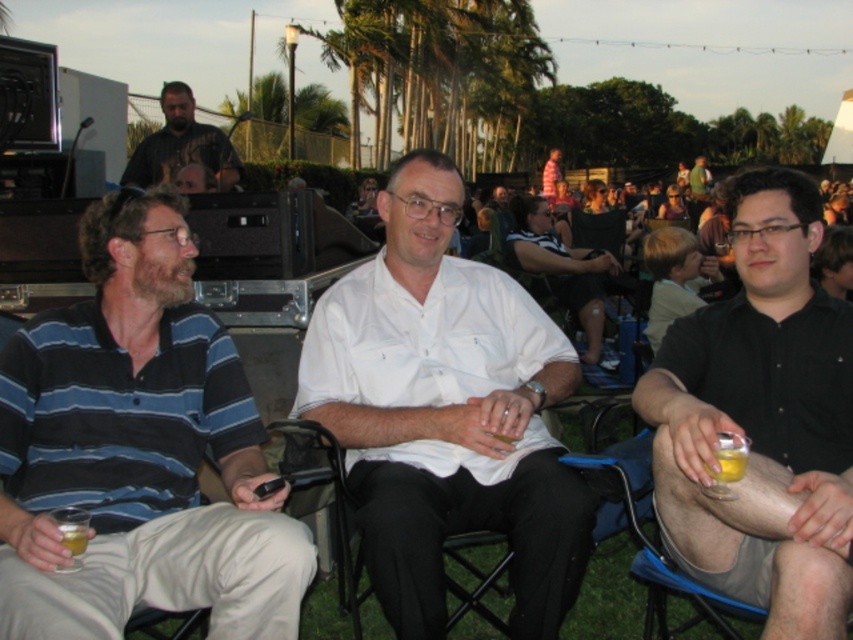
You are a photographer at the event and want to capture both the white cotton shirt at center and the black shirt at right in a single shot. Based on their positions, which one is closer to the camera?

The white cotton shirt at center is located below the black shirt at right, which means it is closer to the camera.

You are a photographer at the event and want to capture both the blue striped polo shirt at left and the translucent glass at lower left in a single shot. Since you can only focus on one subject, which one should you choose to ensure the other remains in the background?

You should focus on the blue striped polo shirt at left because it is closer to the viewer than the translucent glass at lower left, allowing the glass to stay in the background while the shirt remains in focus.